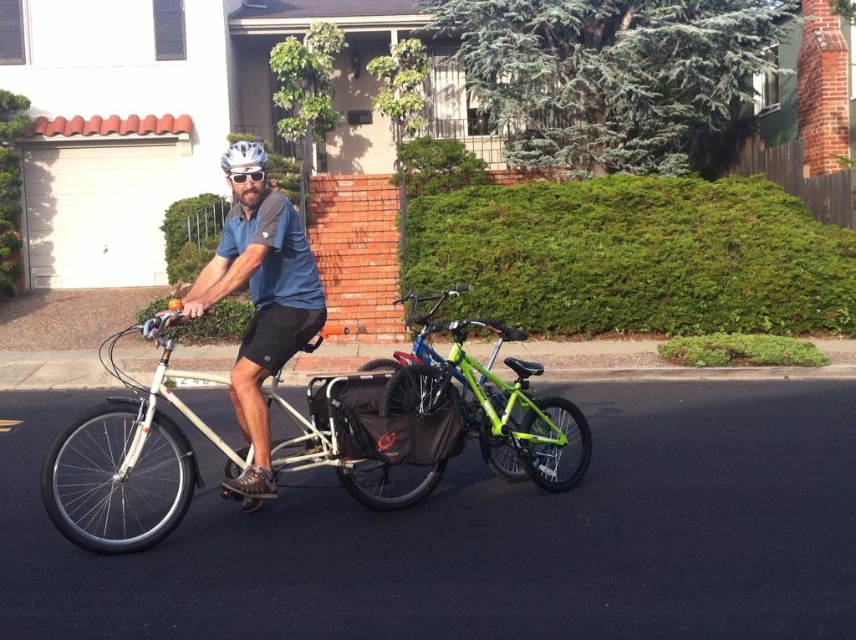
You are a delivery person who needs to deliver a package to a customer located 20 feet away from your current position. You are standing next to the white matte bicycle at center. Can you reach the customer without moving the bicycle?

The distance between the white matte bicycle at center and the camera is 17.56 feet. Since the customer is 20 feet away, you cannot reach them without moving the bicycle because the distance from your current position to the customer is greater than the distance you can cover from the bicycle.

You are a delivery person who needs to attach a small package to your delivery bike. You have a white matte bicycle at center and a white matte bicycle helmet at center. Which object has a larger surface area to attach the package?

The white matte bicycle helmet at center has a larger surface area than the white matte bicycle at center, so the package should be attached to the white matte bicycle helmet at center.

You are a delivery person who needs to choose between the white matte bicycle at center and the green matte bicycle at center for a delivery route. Which bicycle is positioned closer to you, making it easier to reach?

The white matte bicycle at center is closer to the viewer than the green matte bicycle at center, so it is easier to reach.